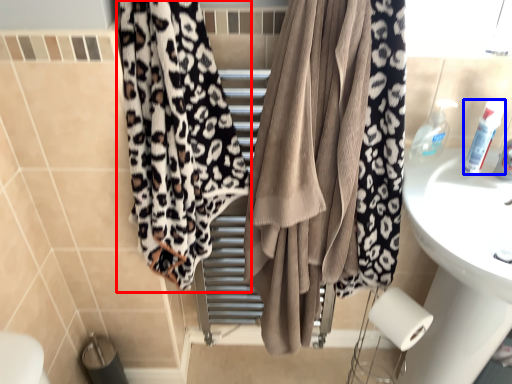
Question: Which object is further to the camera taking this photo, curtain (highlighted by a red box) or toiletry (highlighted by a blue box)?

Choices:
 (A) curtain
 (B) toiletry

Answer: (B)